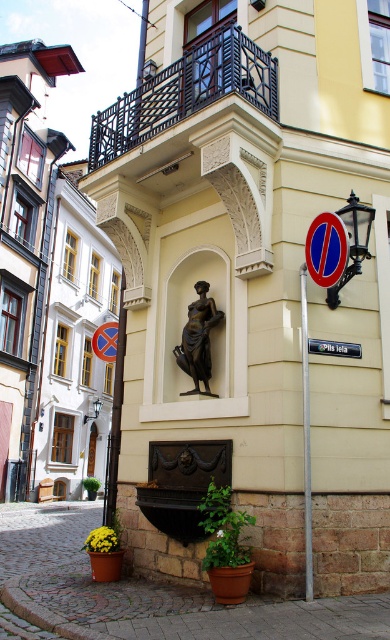
Question: Does bronze statue at center appear over brushed metal pole at center?

Choices:
 (A) no
 (B) yes

Answer: (B)

Question: Among these points, which one is nearest to the camera?

Choices:
 (A) (331, 340)
 (B) (205, 365)

Answer: (A)

Question: Does brushed metal pole at center have a larger size compared to blue plastic sign at center?

Choices:
 (A) yes
 (B) no

Answer: (A)

Question: Is bronze statue at center thinner than blue plastic sign at center?

Choices:
 (A) no
 (B) yes

Answer: (A)

Question: Which object is farther from the camera taking this photo?

Choices:
 (A) blue plastic sign at center
 (B) bronze statue at center

Answer: (B)

Question: Which point is farther from the camera taking this photo?

Choices:
 (A) (356, 353)
 (B) (216, 394)

Answer: (B)